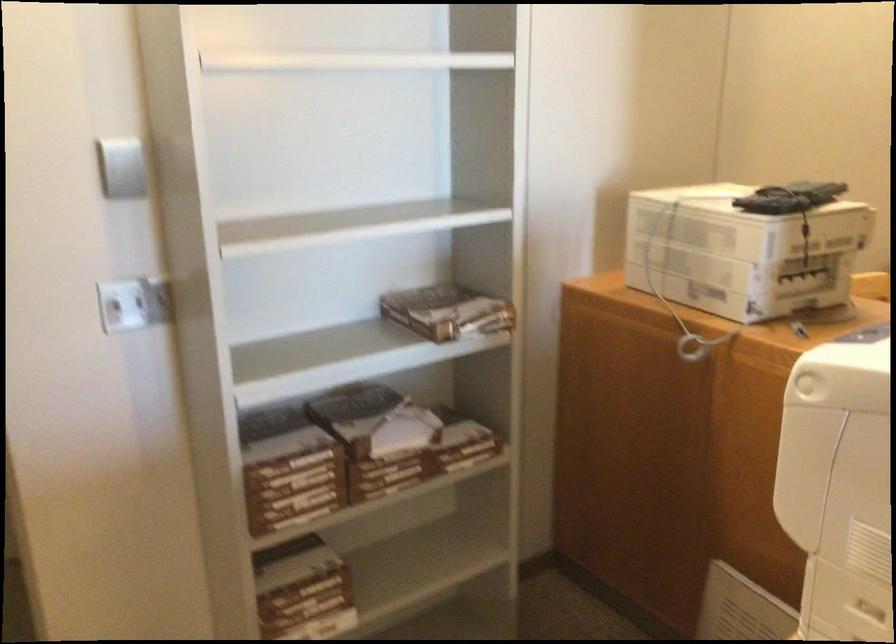
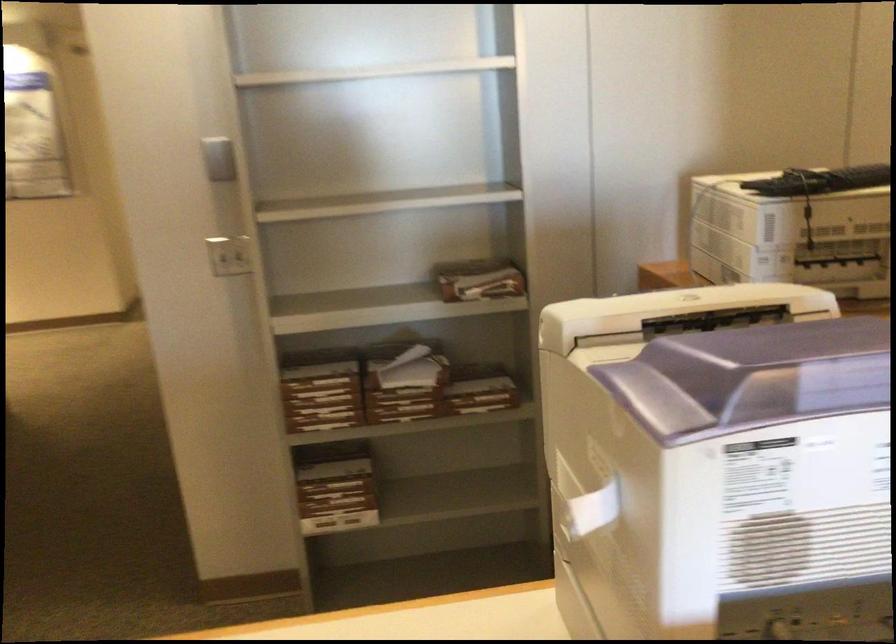
Question: How did the camera likely rotate?

Choices:
 (A) Left
 (B) Right
 (C) Up
 (D) Down

Answer: (A)